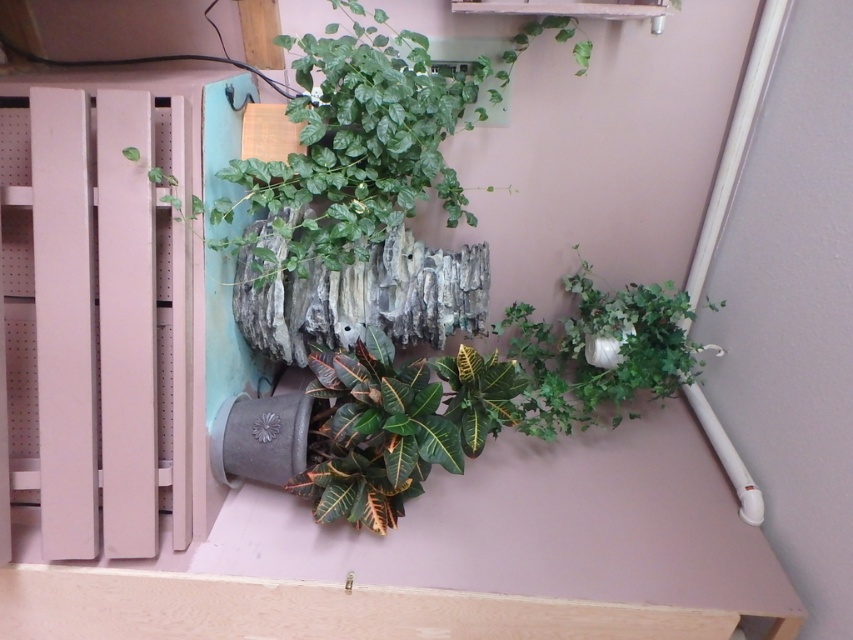
You are an interior designer arranging plants in a room. You have two plants to place on a shelf that is 14 inches wide. The plants must be placed so that they are at least 1 inch apart from each other. Can both plants, the green leafy plant at upper center and the green matte plant at center, fit on the shelf?

The green leafy plant at upper center is 13.56 inches from the green matte plant at center. Since the shelf is 14 inches wide and the plants need to be at least 1 inch apart, the total required space would be 13.56 inches plus 1 inch, totaling 14.56 inches. This exceeds the shelf width of 14 inches, so both plants cannot fit on the shelf.